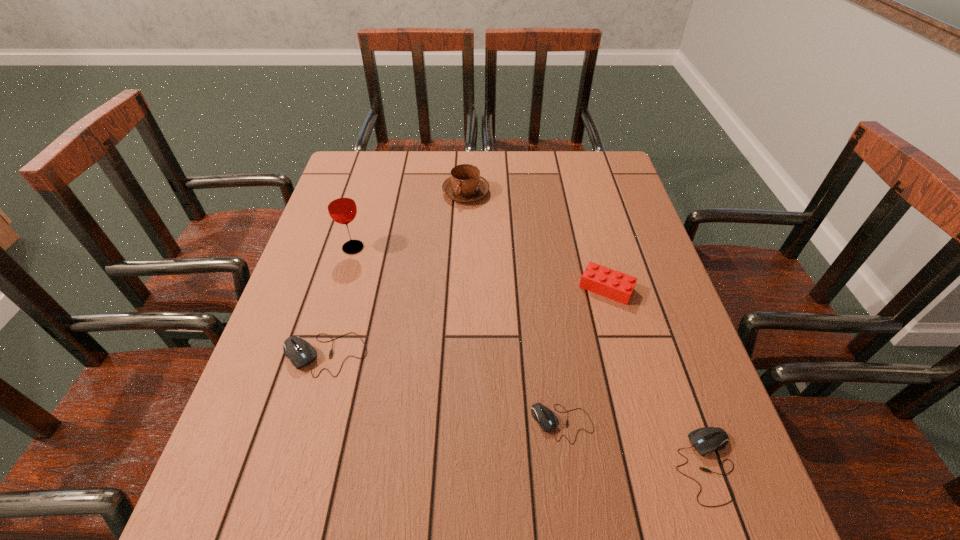
The image size is (960, 540). Identify the location of glass. (341, 205).

This screenshot has height=540, width=960. Identify the location of the second farthest object. (341, 205).

At what (x,y) coordinates should I click in order to perform the action: click on vacant space positioned on the right of the tallest computer mouse. Please return your answer as a coordinate pair (x, y). Image resolution: width=960 pixels, height=540 pixels. Looking at the image, I should click on (483, 354).

In order to click on free space located on the back of the shortest object in this screenshot , I will do `click(548, 320)`.

This screenshot has height=540, width=960. I want to click on free space located 0.340m on the left of the fifth tallest object, so 484,465.

What are the coordinates of `vacant space located 0.130m on the side of the second tallest object with the handle` in the screenshot? It's located at (465, 235).

I want to click on vacant space located on the front of the third farthest object, so (629, 371).

Identify the location of vacant space positioned on the left of the fifth nearest object. The height and width of the screenshot is (540, 960). (322, 248).

Where is `object that is at the far edge`? This screenshot has height=540, width=960. object that is at the far edge is located at coordinates (465, 184).

I want to click on computer mouse that is positioned at the left edge, so click(300, 352).